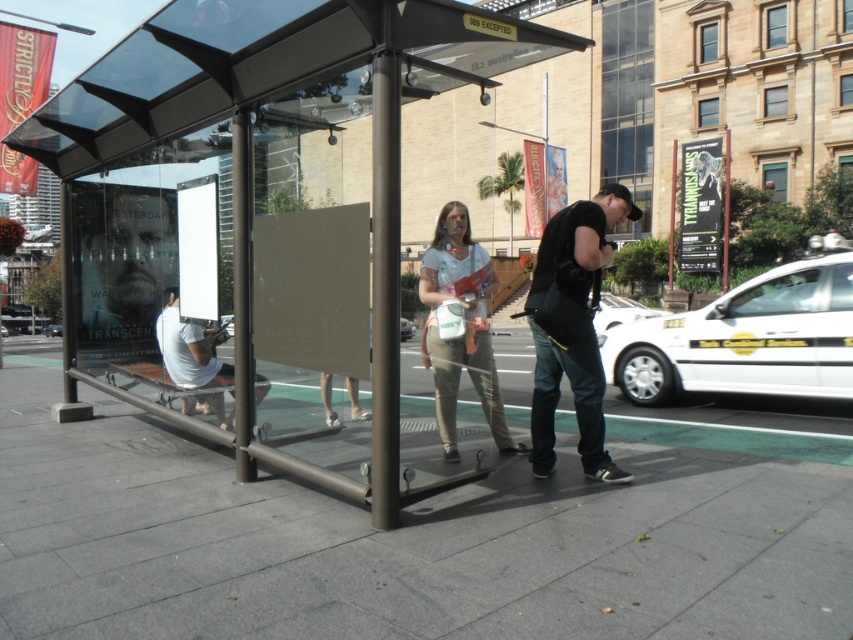
Which is in front, point (849, 321) or point (431, 358)?

Point (431, 358) is more forward.

Looking at this image, does white glossy taxi at right come behind light brown fabric pants at center?

Yes, it is.

Is point (671, 380) more distant than point (469, 348)?

Yes, point (671, 380) is behind point (469, 348).

Find the location of `white glossy taxi at right`. white glossy taxi at right is located at coordinates [747, 337].

Which is behind, point (410, 38) or point (798, 356)?

Point (798, 356)

Is transparent glass canopy at upper center closer to camera compared to white glossy taxi at right?

That is False.

What do you see at coordinates (262, 65) in the screenshot? This screenshot has width=853, height=640. I see `transparent glass canopy at upper center` at bounding box center [262, 65].

At what (x,y) coordinates should I click in order to perform the action: click on transparent glass canopy at upper center. Please return your answer as a coordinate pair (x, y). The height and width of the screenshot is (640, 853). Looking at the image, I should click on (262, 65).

Based on the photo, between gray concrete pavement at center and white glossy taxi at right, which one has more height?

With more height is white glossy taxi at right.

From the picture: Can you confirm if gray concrete pavement at center is positioned below white glossy taxi at right?

Correct, gray concrete pavement at center is located below white glossy taxi at right.

Find the location of a particular element. This screenshot has height=640, width=853. gray concrete pavement at center is located at coordinates (410, 538).

Locate an element on the screen. gray concrete pavement at center is located at coordinates (410, 538).